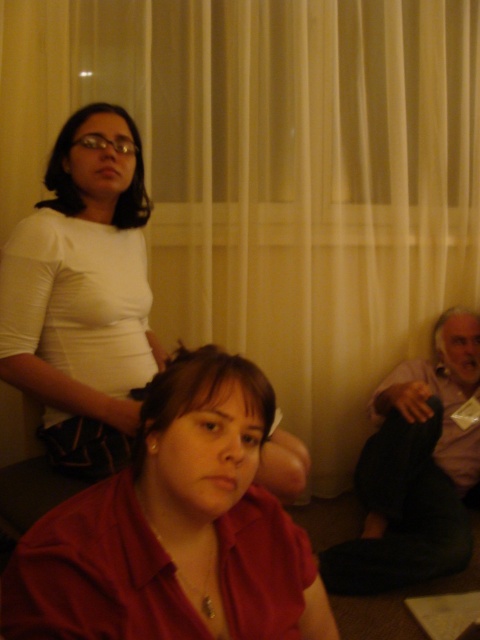
You are a photographer setting up for a group photo. You notice two shirts in the scene, the matte white shirt at upper left and the light pink fabric shirt at lower right. Which shirt is positioned closer to the camera?

The matte white shirt at upper left is closer to the viewer than the light pink fabric shirt at lower right, so it is positioned closer to the camera.